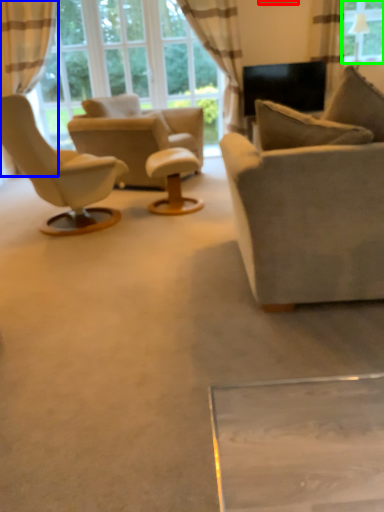
Question: Estimate the real-world distances between objects in this image. Which object is farther from picture frame (highlighted by a red box), curtain (highlighted by a blue box) or window (highlighted by a green box)?

Choices:
 (A) curtain
 (B) window

Answer: (A)